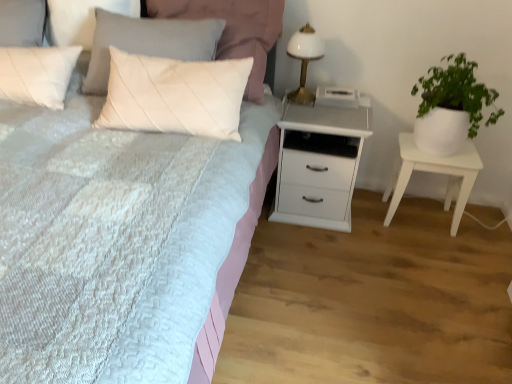
You are a GUI agent. You are given a task and a screenshot of the screen. Output one action in this format:
    pyautogui.click(x=<x>, y=<y>)
    Task: Click on the free spot to the left of white matte nightstand at right
    The width and height of the screenshot is (512, 384).
    Given the screenshot: What is the action you would take?
    click(x=370, y=220)